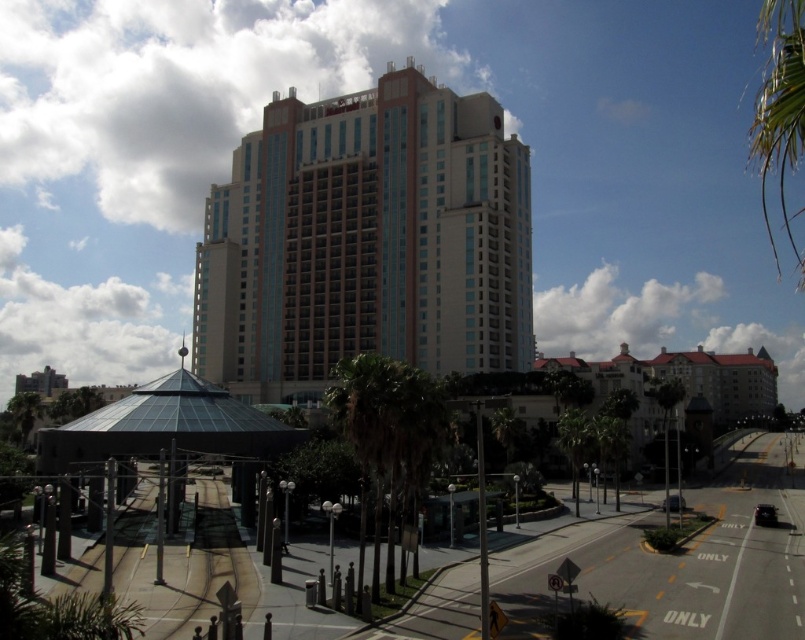
Question: Which point appears closest to the camera in this image?

Choices:
 (A) (357, 429)
 (B) (760, 179)

Answer: (A)

Question: Does green leafy palm tree at center appear on the right side of green leafy palm tree at upper right?

Choices:
 (A) no
 (B) yes

Answer: (A)

Question: Can you confirm if beige glass building at center is positioned to the left of green leafy palm tree at upper right?

Choices:
 (A) no
 (B) yes

Answer: (B)

Question: Which object is positioned farthest from the beige glass building at center?

Choices:
 (A) green leafy palm tree at center
 (B) green leafy palm tree at upper right

Answer: (B)

Question: Which of the following is the farthest from the observer?

Choices:
 (A) (378, 536)
 (B) (496, 278)

Answer: (B)

Question: Can you confirm if green leafy palm tree at center is bigger than green leafy palm tree at upper right?

Choices:
 (A) yes
 (B) no

Answer: (B)